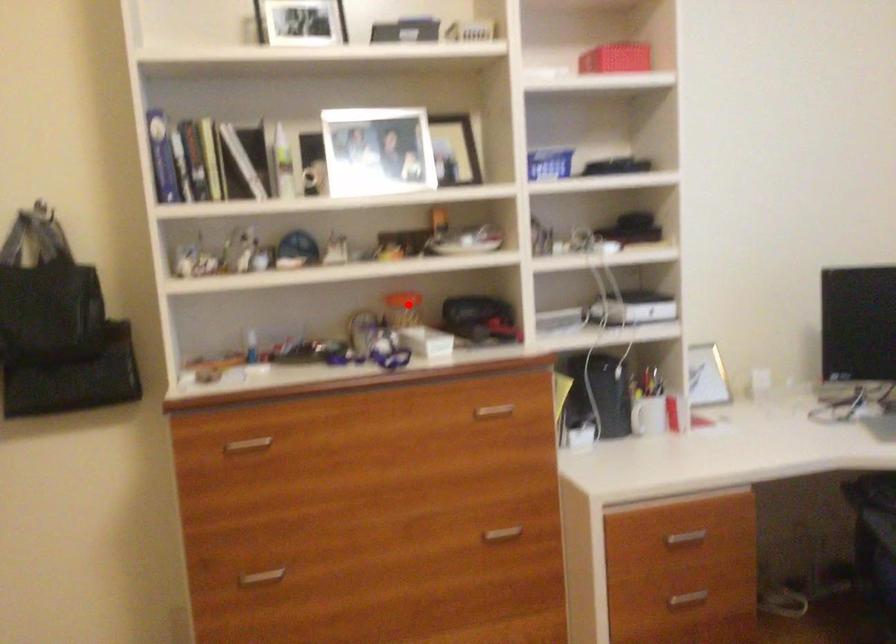
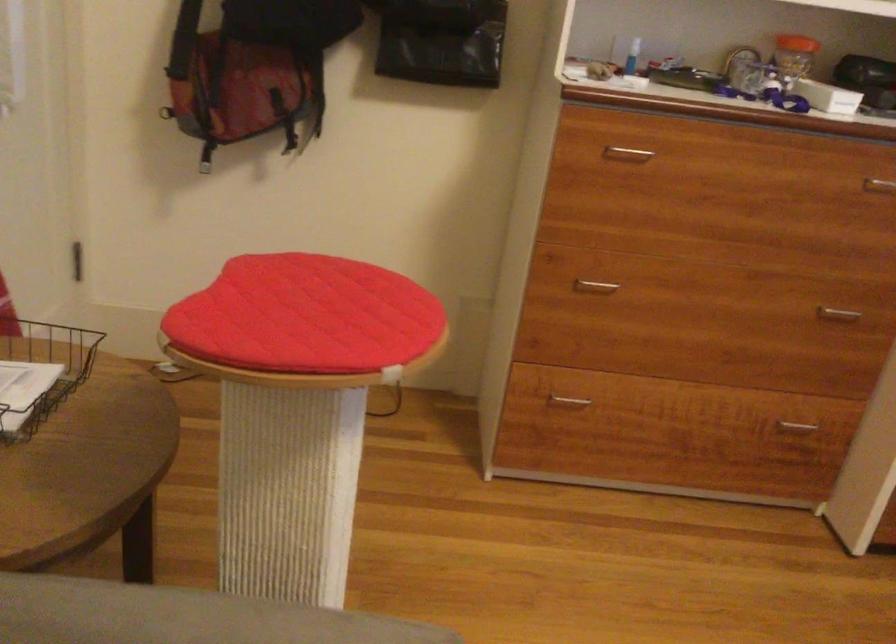
Where in the second image is the point corresponding to the highlighted location from the first image?

(794, 53)